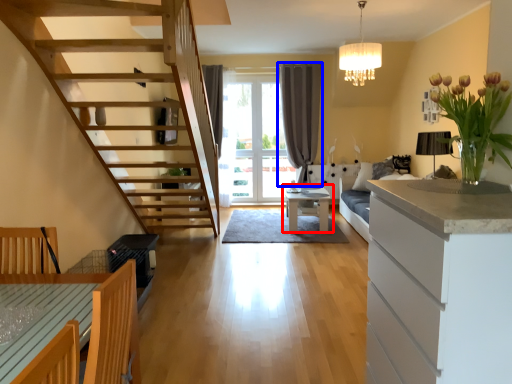
Question: Among these objects, which one is nearest to the camera, table (highlighted by a red box) or curtain (highlighted by a blue box)?

Choices:
 (A) table
 (B) curtain

Answer: (A)